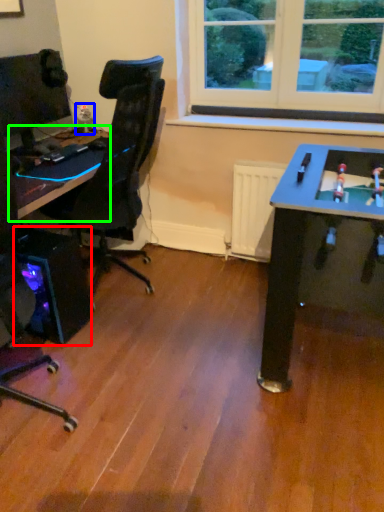
Question: Considering the real-world distances, which object is closest to computer tower (highlighted by a red box)? toy (highlighted by a blue box) or table (highlighted by a green box).

Choices:
 (A) toy
 (B) table

Answer: (B)